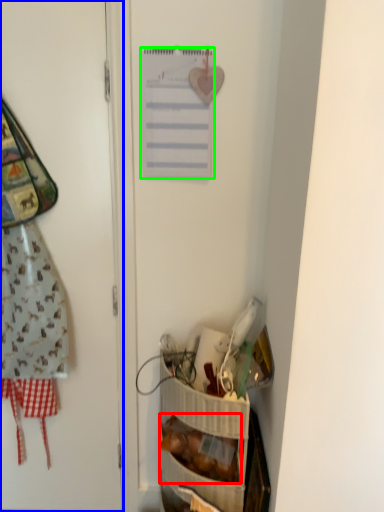
Question: Which is farther away from food (highlighted by a red box)? door (highlighted by a blue box) or list (highlighted by a green box)?

Choices:
 (A) door
 (B) list

Answer: (B)